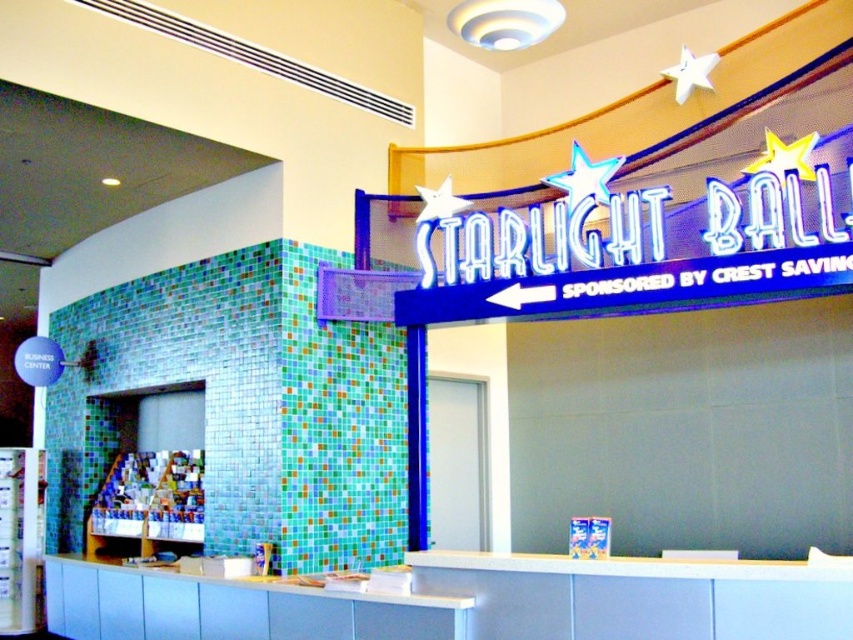
You are an event planner checking the STARLIGHT BALL sign for an upcoming event. You notice two stars above the main text. Which star, the neon blue star at upper center or the metallic silver star at upper center, is bigger?

The neon blue star at upper center is larger than the metallic silver star at upper center according to the description.

You are an event planner looking at the STARLIGHT BALL sign. You notice two stars above the main text. Which star is positioned lower between the neon blue star at upper center and the metallic silver star at upper right?

The neon blue star at upper center is positioned lower than the metallic silver star at upper right.

You are an event planner setting up a photo booth in front of the STARLIGHT BALL sign. The photo booth requires a minimum of 1.5 meters of space between the two stars to ensure safety for participants. Based on the scene, will the current spacing between the neon blue star at upper center and the metallic silver star at upper right meet this requirement?

The distance between the neon blue star at upper center and metallic silver star at upper right is 1.34 meters, which is less than the required 1.5 meters. Therefore, the current spacing does not meet the safety requirement for the photo booth.